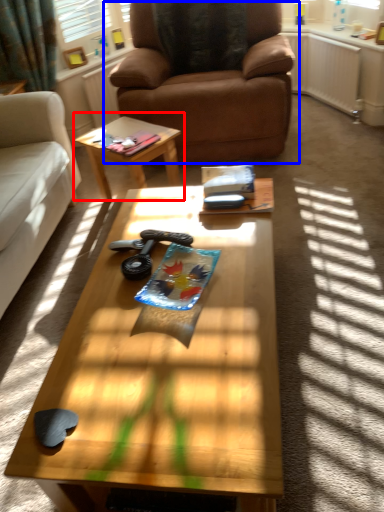
Question: Among these objects, which one is nearest to the camera, coffee table (highlighted by a red box) or chair (highlighted by a blue box)?

Choices:
 (A) coffee table
 (B) chair

Answer: (B)